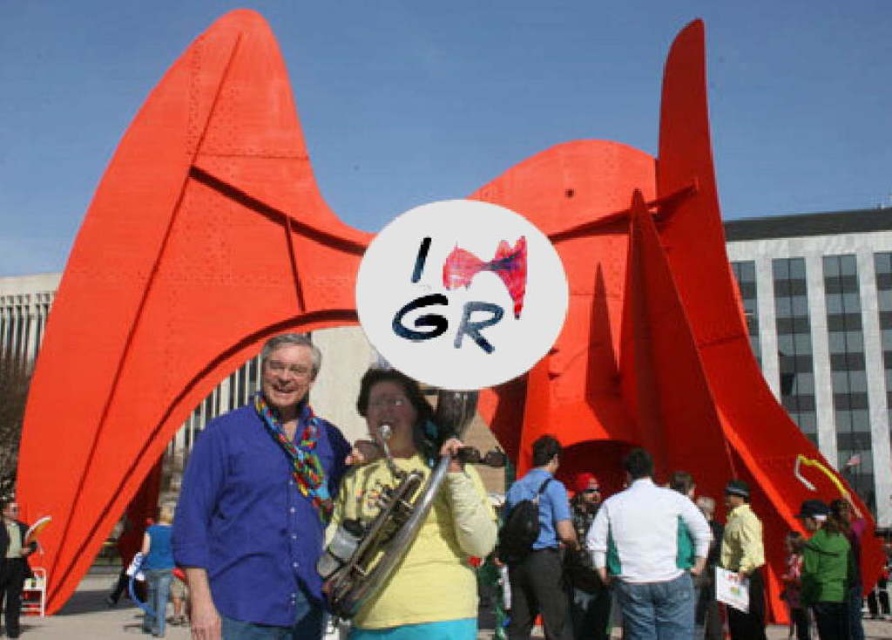
Question: Is white/green fabric jacket at center smaller than yellow shirt at center?

Choices:
 (A) no
 (B) yes

Answer: (A)

Question: In this image, where is blue cotton shirt at center located relative to shiny silver trumpet at center?

Choices:
 (A) above
 (B) below

Answer: (B)

Question: Which of the following is the farthest from the observer?

Choices:
 (A) click(x=368, y=563)
 (B) click(x=558, y=627)
 (C) click(x=626, y=516)

Answer: (B)

Question: Which point is closer to the camera?

Choices:
 (A) blue cotton shirt at center
 (B) shiny silver trumpet at center
 (C) yellow shirt at center

Answer: (B)

Question: Is blue cotton shirt at center positioned behind blue fabric backpack at center?

Choices:
 (A) yes
 (B) no

Answer: (B)

Question: Which of the following is the farthest from the observer?

Choices:
 (A) (734, 547)
 (B) (190, 528)

Answer: (A)